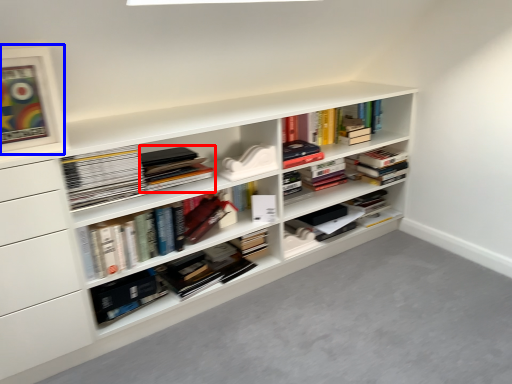
Question: Which point is closer to the camera, book (highlighted by a red box) or picture frame (highlighted by a blue box)?

Choices:
 (A) book
 (B) picture frame

Answer: (B)